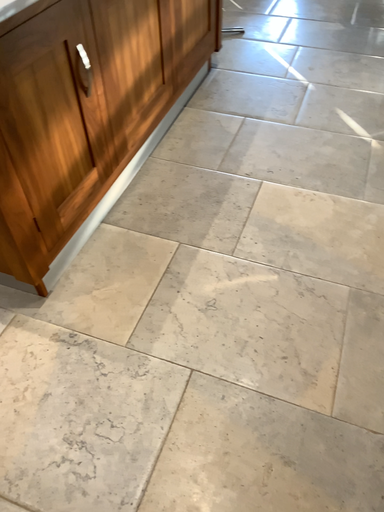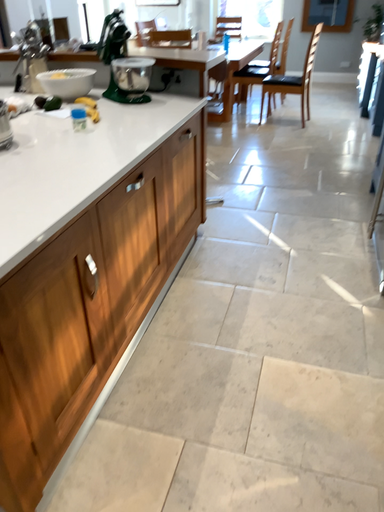
Question: Which way did the camera rotate in the video?

Choices:
 (A) rotated downward
 (B) rotated upward

Answer: (B)